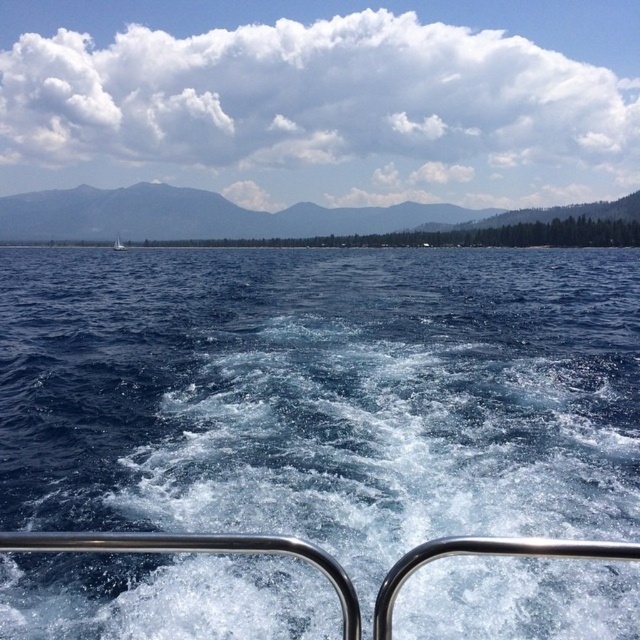
Question: Estimate the real-world distances between objects in this image. Which object is farther from the blue liquid water at center?

Choices:
 (A) green forested mountain at upper center
 (B) white sailboat at left

Answer: (A)

Question: Which of the following is the farthest from the observer?

Choices:
 (A) (474, 260)
 (B) (118, 243)

Answer: (B)

Question: From the image, what is the correct spatial relationship of blue liquid water at center in relation to green forested mountain at upper center?

Choices:
 (A) below
 (B) above

Answer: (A)

Question: Which of the following is the farthest from the observer?

Choices:
 (A) blue liquid water at center
 (B) green forested mountain at upper center
 (C) white sailboat at left

Answer: (B)

Question: Is blue liquid water at center thinner than white sailboat at left?

Choices:
 (A) no
 (B) yes

Answer: (A)

Question: Can you confirm if blue liquid water at center is positioned above white sailboat at left?

Choices:
 (A) no
 (B) yes

Answer: (A)